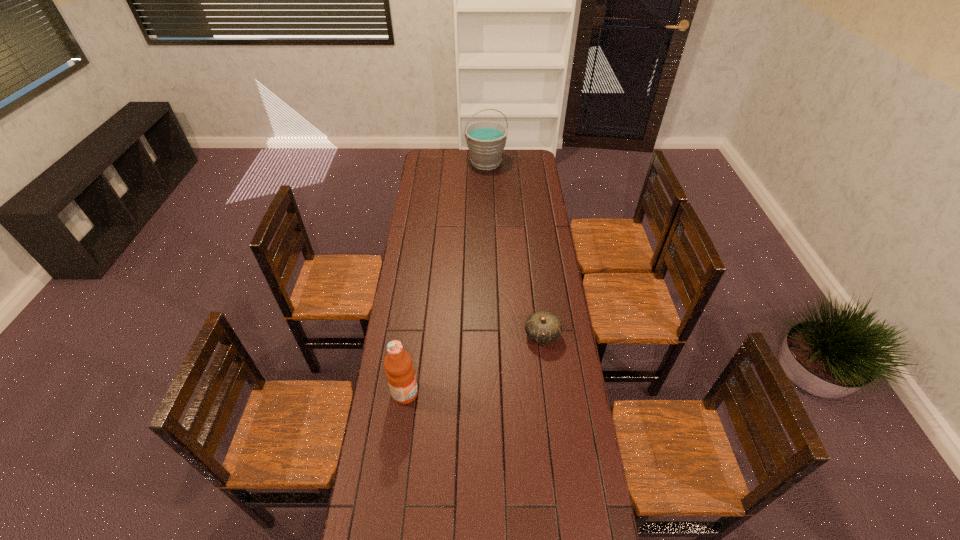
This screenshot has width=960, height=540. Identify the location of the farthest object. (486, 140).

Locate an element on the screen. The width and height of the screenshot is (960, 540). the second object from left to right is located at coordinates click(x=486, y=140).

Find the location of a particular element. The image size is (960, 540). the second tallest object is located at coordinates (400, 373).

This screenshot has width=960, height=540. What are the coordinates of `the nearest object` in the screenshot? It's located at (400, 373).

Image resolution: width=960 pixels, height=540 pixels. What are the coordinates of `gourd` in the screenshot? It's located at (541, 327).

Locate an element on the screen. Image resolution: width=960 pixels, height=540 pixels. the second farthest object is located at coordinates (541, 327).

At what (x,y) coordinates should I click in order to perform the action: click on vacant region located 0.300m on the front of the farthest object. Please return your answer as a coordinate pair (x, y). The height and width of the screenshot is (540, 960). Looking at the image, I should click on (487, 204).

I want to click on vacant space located on the front label of the fruit juice, so click(x=448, y=393).

Find the location of a particular element. This screenshot has height=540, width=960. free space located on the front of the shortest object is located at coordinates (554, 434).

In order to click on object that is at the far edge in this screenshot , I will do `click(486, 140)`.